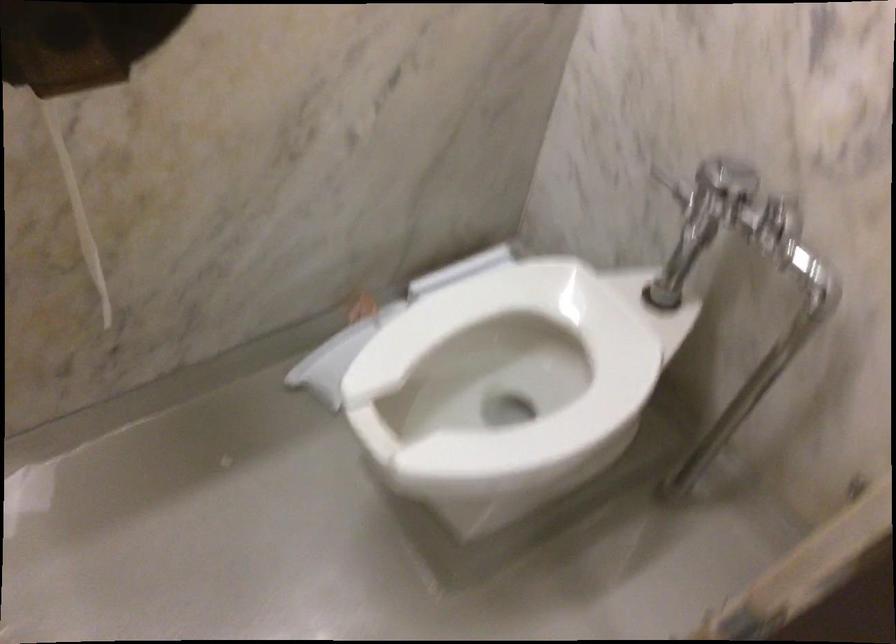
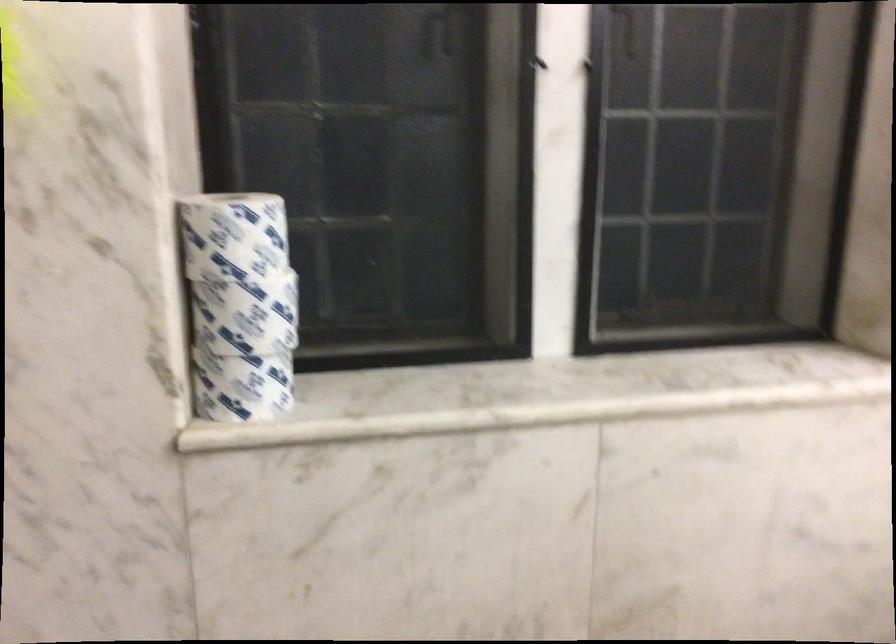
Question: The first image is from the beginning of the video and the second image is from the end. How did the camera likely rotate when shooting the video?

Choices:
 (A) Left
 (B) Right
 (C) Up
 (D) Down

Answer: (B)